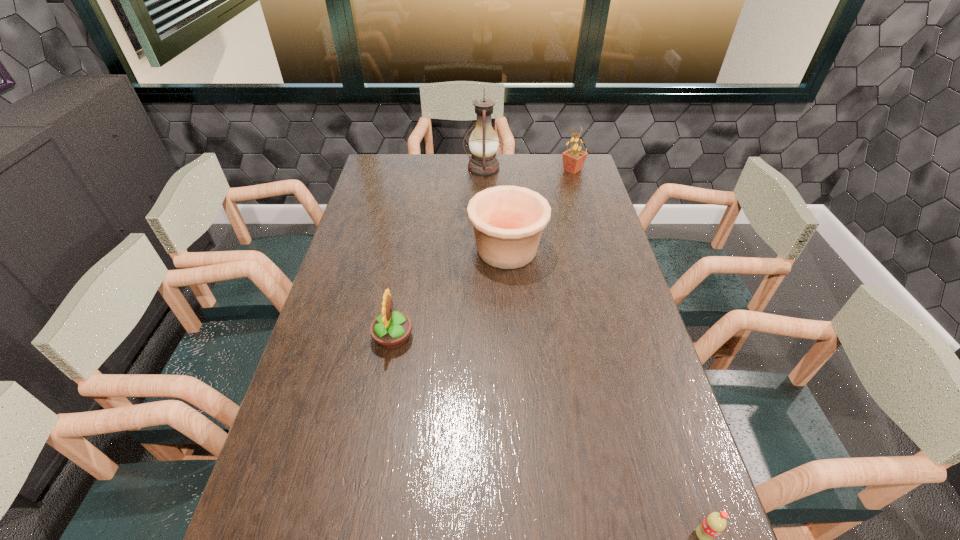
Identify the location of oil lamp. This screenshot has width=960, height=540. (483, 143).

Locate an element on the screen. the right sunflower is located at coordinates (573, 159).

You are a GUI agent. You are given a task and a screenshot of the screen. Output one action in this format:
    pyautogui.click(x=<x>, y=<y>)
    Task: Click on the third farthest object
    This screenshot has width=960, height=540.
    Given the screenshot: What is the action you would take?
    pyautogui.click(x=508, y=221)

This screenshot has width=960, height=540. In order to click on the leftmost object in this screenshot , I will do `click(391, 329)`.

Locate an element on the screen. This screenshot has width=960, height=540. the left sunflower is located at coordinates (391, 329).

The image size is (960, 540). Find the location of `free location located on the front of the oil lamp`. free location located on the front of the oil lamp is located at coordinates (484, 217).

Image resolution: width=960 pixels, height=540 pixels. I want to click on free space located at the front of the right sunflower with flowers visible, so click(x=470, y=170).

At what (x,y) coordinates should I click in order to perform the action: click on vacant region located 0.170m at the front of the right sunflower with flowers visible. Please return your answer as a coordinate pair (x, y). Looking at the image, I should click on (519, 170).

Locate an element on the screen. free space located at the front of the right sunflower with flowers visible is located at coordinates point(529,170).

The image size is (960, 540). I want to click on free spot located 0.230m on the back of the pottery, so click(x=503, y=191).